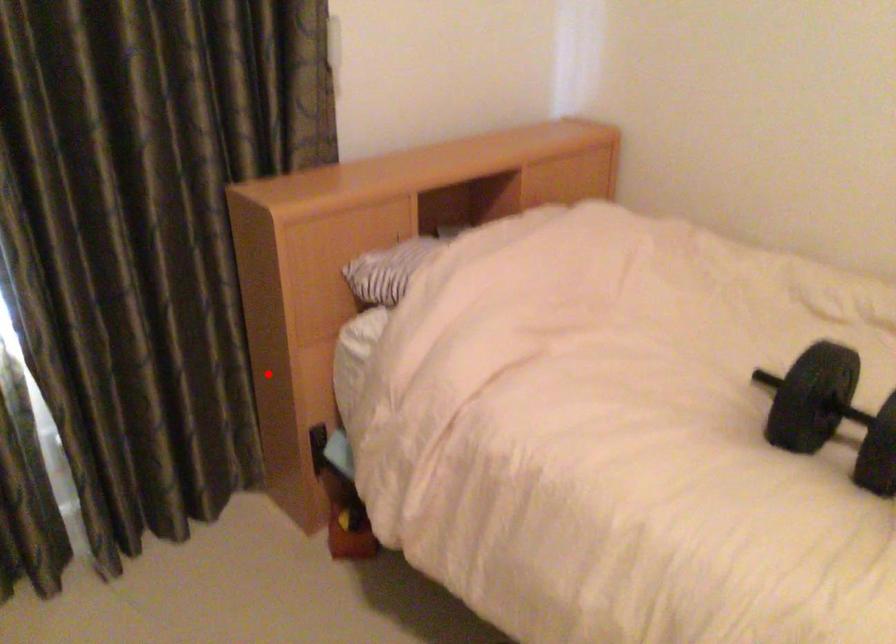
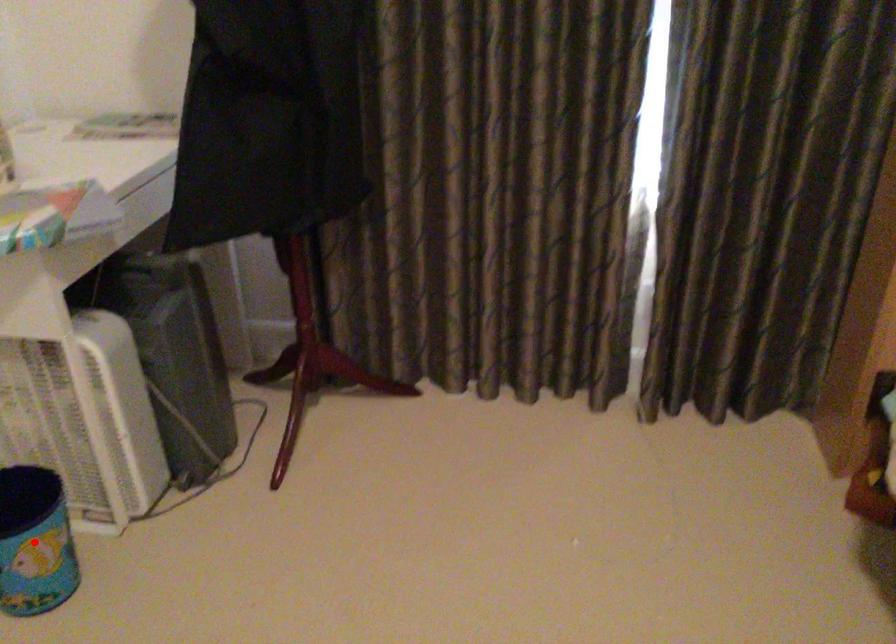
I am providing you with two images of the same scene from different viewpoints. A red point is marked on the first image and another point is marked on the second image. Are the points marked in image1 and image2 representing the same 3D position?

No